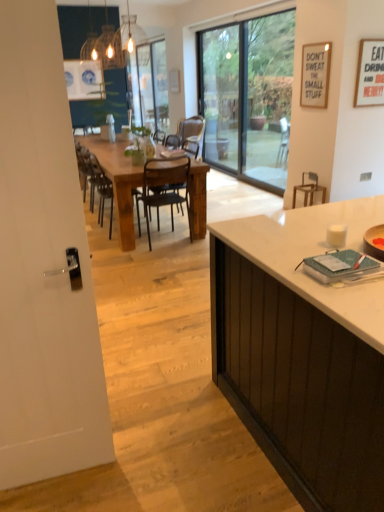
Describe the element at coordinates (104, 46) in the screenshot. I see `matte glass chandelier at upper center` at that location.

The image size is (384, 512). Identify the location of metallic black chair at center, the second chair in the right-to-left sequence. (165, 187).

Locate an element on the screen. white matte cabinet at right is located at coordinates (304, 348).

In order to face white matte cabinet at right, should I rotate leftwards or rightwards?

You should look right and rotate roughly 25.001 degrees.

What is the approximate height of transparent glass door at center?

transparent glass door at center is 2.29 meters in height.

Where is `wooden armchair at right`? wooden armchair at right is located at coordinates pos(309,189).

Measure the distance between point [111,163] and camera.

Point [111,163] and camera are 4.53 meters apart.

From the picture: In order to face black metal chair at center, the 1th chair in the right-to-left sequence, should I rotate leftwards or rightwards?

A 2.442 degree turn to the left will do.

Locate an element on the screen. Image resolution: width=384 pixels, height=512 pixels. matte glass chandelier at upper center is located at coordinates (104, 46).

From a real-world perspective, is black metal chair at center, the 1th chair in the right-to-left sequence, on top of white matte cabinet at right?

No, from a real-world perspective, black metal chair at center, the 1th chair in the right-to-left sequence, is not over white matte cabinet at right

Is black metal chair at center, the 1th chair in the right-to-left sequence, further to the viewer compared to white matte cabinet at right?

Yes, it is.

Is black metal chair at center, arranged as the third chair when viewed from the left, at the left side of white matte cabinet at right?

Yes.

Which object is thinner, black metal chair at center, arranged as the third chair when viewed from the left, or white matte cabinet at right?

black metal chair at center, arranged as the third chair when viewed from the left, is thinner.

From the image's perspective, which one is positioned lower, black metal chair at center, arranged as the third chair when viewed from the left, or transparent glass door at center?

black metal chair at center, arranged as the third chair when viewed from the left, appears lower in the image.

Is black metal chair at center, the 1th chair in the right-to-left sequence, beside transparent glass door at center?

No, black metal chair at center, the 1th chair in the right-to-left sequence, is not beside transparent glass door at center.

Is black metal chair at center, arranged as the third chair when viewed from the left, situated inside transparent glass door at center or outside?

black metal chair at center, arranged as the third chair when viewed from the left, cannot be found inside transparent glass door at center.

Is black metal chair at center, the 1th chair in the right-to-left sequence, looking in the opposite direction of transparent glass door at center?

That's not correct — black metal chair at center, the 1th chair in the right-to-left sequence, is not looking away from transparent glass door at center.

Who is taller, wooden chair at center, the 3th chair positioned from the right, or wooden armchair at right?

wooden chair at center, the 3th chair positioned from the right.

From a real-world perspective, is wooden chair at center, the 3th chair positioned from the right, positioned over wooden armchair at right based on gravity?

Yes, from a real-world perspective, wooden chair at center, the 3th chair positioned from the right, is on top of wooden armchair at right.

Can you confirm if wooden chair at center, acting as the 1th chair starting from the left, is positioned to the right of wooden armchair at right?

Incorrect, wooden chair at center, acting as the 1th chair starting from the left, is not on the right side of wooden armchair at right.

Looking at their sizes, would you say rustic wood table at center is wider or thinner than white glossy door at left, which is counted as the 2th screen door, starting from the back?

Considering their sizes, rustic wood table at center looks broader than white glossy door at left, which is counted as the 2th screen door, starting from the back.

How much distance is there between rustic wood table at center and white glossy door at left, which is the first screen door in bottom-to-top order?

rustic wood table at center is 2.76 meters away from white glossy door at left, which is the first screen door in bottom-to-top order.

Are rustic wood table at center and white glossy door at left, placed as the 1th screen door when sorted from front to back, located far from each other?

Yes, rustic wood table at center is far from white glossy door at left, placed as the 1th screen door when sorted from front to back.

From a real-world perspective, who is located lower, rustic wood table at center or white glossy door at left, marked as the first screen door in a left-to-right arrangement?

rustic wood table at center is physically lower.

From their relative heights in the image, would you say metallic black chair at center, the second chair viewed from the left, is taller or shorter than transparent glass door at center?

metallic black chair at center, the second chair viewed from the left, is shorter than transparent glass door at center.

You are a GUI agent. You are given a task and a screenshot of the screen. Output one action in this format:
    pyautogui.click(x=<x>, y=<y>)
    Task: Click on the window screen behind the metallic black chair at center, the second chair in the right-to-left sequence
    The image size is (384, 512).
    Given the screenshot: What is the action you would take?
    pyautogui.click(x=267, y=96)

Between metallic black chair at center, the second chair in the right-to-left sequence, and transparent glass door at center, which one has smaller size?

Smaller between the two is metallic black chair at center, the second chair in the right-to-left sequence.

Is metallic black chair at center, the second chair in the right-to-left sequence, not within black metal chair at center, arranged as the third chair when viewed from the left?

Yes, metallic black chair at center, the second chair in the right-to-left sequence, is located beyond the bounds of black metal chair at center, arranged as the third chair when viewed from the left.

Considering the relative sizes of metallic black chair at center, the second chair in the right-to-left sequence, and black metal chair at center, the 1th chair in the right-to-left sequence, in the image provided, is metallic black chair at center, the second chair in the right-to-left sequence, shorter than black metal chair at center, the 1th chair in the right-to-left sequence,?

Incorrect, the height of metallic black chair at center, the second chair in the right-to-left sequence, does not fall short of that of black metal chair at center, the 1th chair in the right-to-left sequence.

Which of these two, metallic black chair at center, the second chair in the right-to-left sequence, or black metal chair at center, arranged as the third chair when viewed from the left, is bigger?

metallic black chair at center, the second chair in the right-to-left sequence, is bigger.

Is metallic black chair at center, the second chair viewed from the left, far away from black metal chair at center, arranged as the third chair when viewed from the left?

No, metallic black chair at center, the second chair viewed from the left, is not far away from black metal chair at center, arranged as the third chair when viewed from the left.

Is metallic black chair at center, the second chair viewed from the left, looking in the opposite direction of white matte cabinet at right?

Yes, metallic black chair at center, the second chair viewed from the left, is facing away from white matte cabinet at right.

Considering the sizes of objects metallic black chair at center, the second chair in the right-to-left sequence, and white matte cabinet at right in the image provided, who is thinner, metallic black chair at center, the second chair in the right-to-left sequence, or white matte cabinet at right?

Thinner between the two is metallic black chair at center, the second chair in the right-to-left sequence.

How far apart are metallic black chair at center, the second chair in the right-to-left sequence, and white matte cabinet at right?

A distance of 7.78 feet exists between metallic black chair at center, the second chair in the right-to-left sequence, and white matte cabinet at right.

Image resolution: width=384 pixels, height=512 pixels. What are the coordinates of `cabinetry above the black metal chair at center, arranged as the third chair when viewed from the left (from a real-world perspective)` in the screenshot? It's located at (304, 348).

Locate an element on the screen. The width and height of the screenshot is (384, 512). window screen that is on the right side of black metal chair at center, the 1th chair in the right-to-left sequence is located at coordinates (267, 96).

Estimate the real-world distances between objects in this image. Which object is further from black metal chair at center, the 1th chair in the right-to-left sequence, wooden armchair at right or rustic wood table at center?

Based on the image, wooden armchair at right appears to be further to black metal chair at center, the 1th chair in the right-to-left sequence.

Looking at the image, which one is located further to transparent glass door at center, metallic black chair at center, the second chair viewed from the left, or black metal chair at center, the 1th chair in the right-to-left sequence?

black metal chair at center, the 1th chair in the right-to-left sequence, is positioned further to the anchor transparent glass door at center.

Which object lies further to the anchor point wooden chair at center, the 3th chair positioned from the right, wooden armchair at right or black metal chair at center, the 1th chair in the right-to-left sequence?

wooden armchair at right lies further to wooden chair at center, the 3th chair positioned from the right, than the other object.

From the picture: Looking at the image, which one is located further to matte glass chandelier at upper center, black metal chair at center, arranged as the third chair when viewed from the left, or transparent glass screen door at center, positioned as the 1th screen door in back-to-front order?

black metal chair at center, arranged as the third chair when viewed from the left, is further to matte glass chandelier at upper center.

Which object lies further to the anchor point wooden armchair at right, matte glass chandelier at upper center or white matte cabinet at right?

matte glass chandelier at upper center is further to wooden armchair at right.

From the image, which object appears to be nearer to white glossy door at left, marked as the first screen door in a left-to-right arrangement, transparent glass door at center or transparent glass screen door at center, the 2th screen door viewed from the front?

transparent glass door at center.

Based on their spatial positions, is transparent glass screen door at center, positioned as the 1th screen door in back-to-front order, or metallic black chair at center, the second chair in the right-to-left sequence, closer to transparent glass door at center?

transparent glass screen door at center, positioned as the 1th screen door in back-to-front order, is positioned closer to the anchor transparent glass door at center.

Estimate the real-world distances between objects in this image. Which object is further from transparent glass door at center, white matte cabinet at right or black metal chair at center, the 1th chair in the right-to-left sequence?

white matte cabinet at right.

Identify the location of window screen between white glossy door at left, marked as the first screen door in a left-to-right arrangement, and transparent glass screen door at center, the 2th screen door viewed from the front, in the front-back direction. The width and height of the screenshot is (384, 512). (267, 96).

The width and height of the screenshot is (384, 512). I want to click on kitchen & dining room table between white matte cabinet at right and black metal chair at center, the 1th chair in the right-to-left sequence, along the z-axis, so click(x=118, y=181).

The image size is (384, 512). What are the coordinates of `kitchen & dining room table positioned between white glossy door at left, which is the first screen door in bottom-to-top order, and black metal chair at center, the 1th chair in the right-to-left sequence, from near to far` in the screenshot? It's located at (118, 181).

Locate an element on the screen. chair between white glossy door at left, which ranks as the 2th screen door in top-to-bottom order, and wooden chair at center, acting as the 1th chair starting from the left, in the front-back direction is located at coordinates (165, 187).